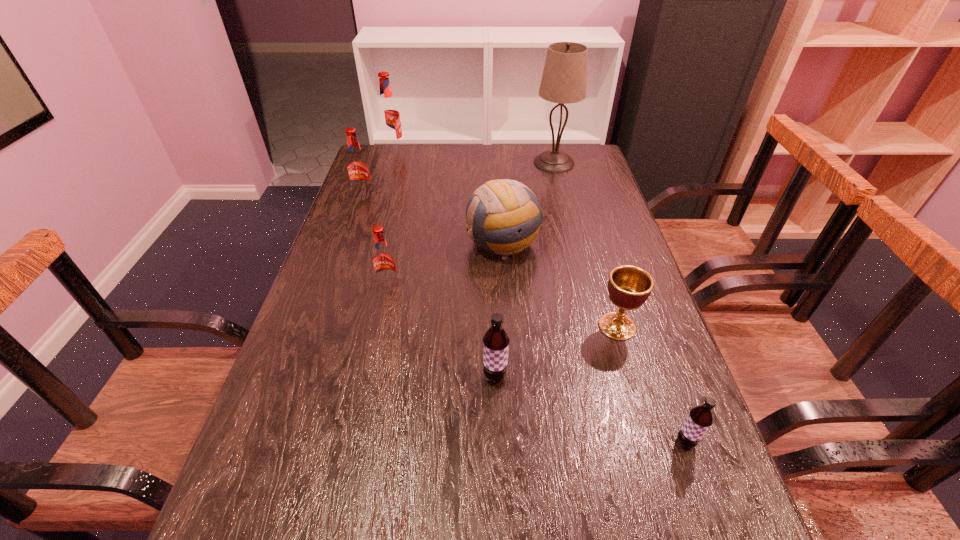
I want to click on vacant area that lies between the fourth farthest object and the shortest root beer, so (594, 342).

Identify which object is located as the sixth nearest to the rightmost root beer. Please provide its 2D coordinates. Your answer should be formatted as a tuple, i.e. [(x, y)], where the tuple contains the x and y coordinates of a point satisfying the conditions above.

[(357, 165)]

Find the location of a particular element. object identified as the fifth closest to the sixth farthest object is located at coordinates (564, 80).

Select which root beer is the fifth closest to the sixth farthest object. Please provide its 2D coordinates. Your answer should be formatted as a tuple, i.e. [(x, y)], where the tuple contains the x and y coordinates of a point satisfying the conditions above.

[(388, 113)]

Locate an element on the screen. The image size is (960, 540). the closest root beer to the third farthest object is located at coordinates (388, 113).

Identify the location of red root beer that can be found as the closest to the second nearest red root beer. (388, 113).

This screenshot has height=540, width=960. Find the location of `red root beer that is the closest to the nearest root beer`. red root beer that is the closest to the nearest root beer is located at coordinates (384, 264).

Identify the location of vacant space that satisfies the following two spatial constraints: 1. on the back side of the fifth nearest object; 2. on the left side of the second nearest root beer. (491, 243).

Find the location of a particular element. Image resolution: width=960 pixels, height=540 pixels. free location that satisfies the following two spatial constraints: 1. on the front side of the nearer brown root beer; 2. on the right side of the third nearest object is located at coordinates (652, 442).